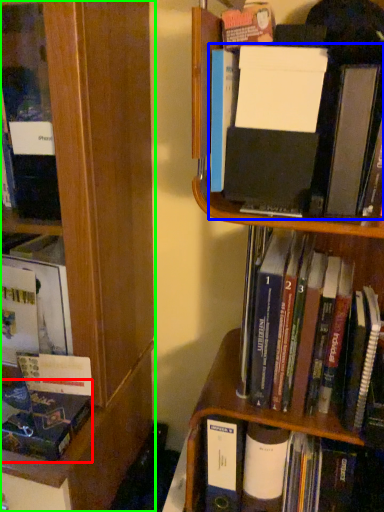
Question: Which object is the farthest from book (highlighted by a red box)? Choose among these: book (highlighted by a blue box) or bookcase (highlighted by a green box).

Choices:
 (A) book
 (B) bookcase

Answer: (A)